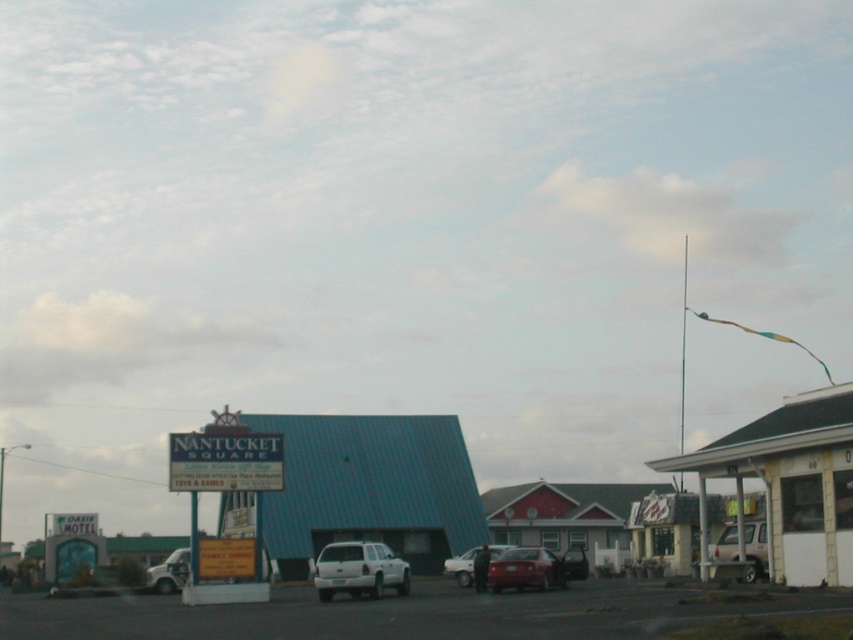
Question: Is white matte truck at center below silver metallic van at center?

Choices:
 (A) no
 (B) yes

Answer: (B)

Question: Does silver metallic van at center have a greater width compared to white matte truck at lower left?

Choices:
 (A) yes
 (B) no

Answer: (B)

Question: Which point is closer to the camera?

Choices:
 (A) (407, 540)
 (B) (164, 589)
 (C) (186, 448)

Answer: (C)

Question: Is shiny red sedan at center below white matte truck at lower left?

Choices:
 (A) yes
 (B) no

Answer: (B)

Question: Based on their relative distances, which object is farther from the blue corrugated metal motel at center?

Choices:
 (A) white matte truck at lower left
 (B) shiny red sedan at center
 (C) silver metallic van at center

Answer: (B)

Question: Which of the following is the farthest from the observer?

Choices:
 (A) (338, 573)
 (B) (756, 550)
 (C) (178, 570)

Answer: (C)